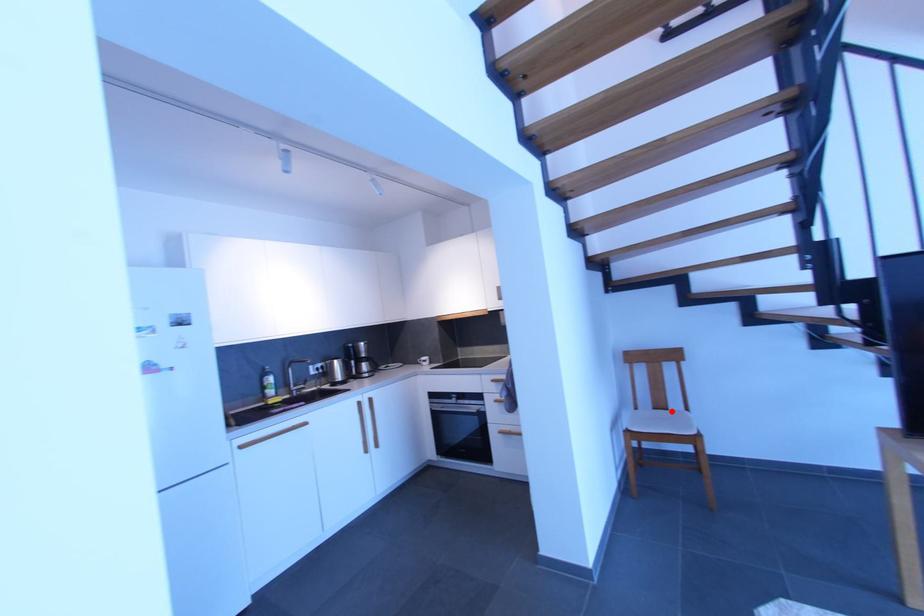
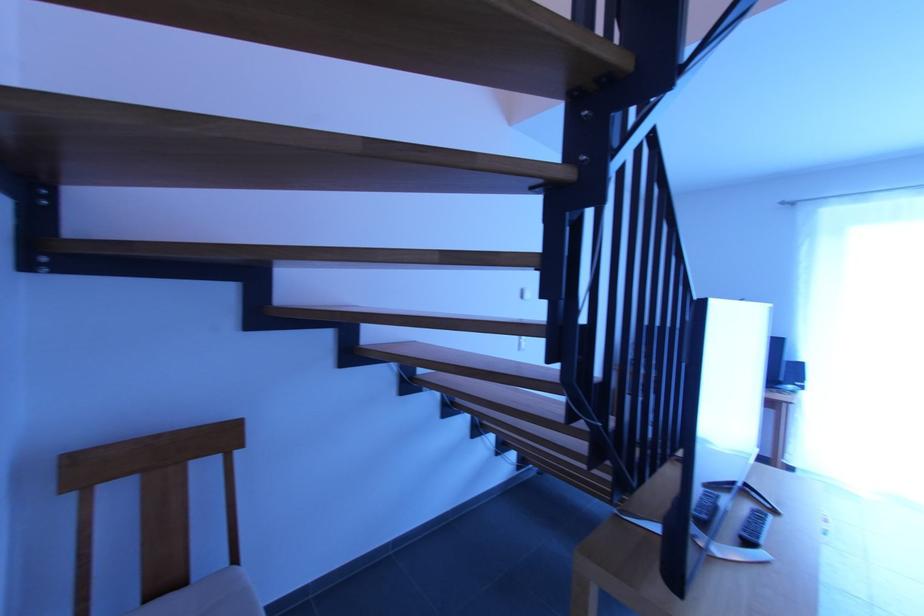
Where in the second image is the point corresponding to the highlighted location from the first image?

(189, 584)